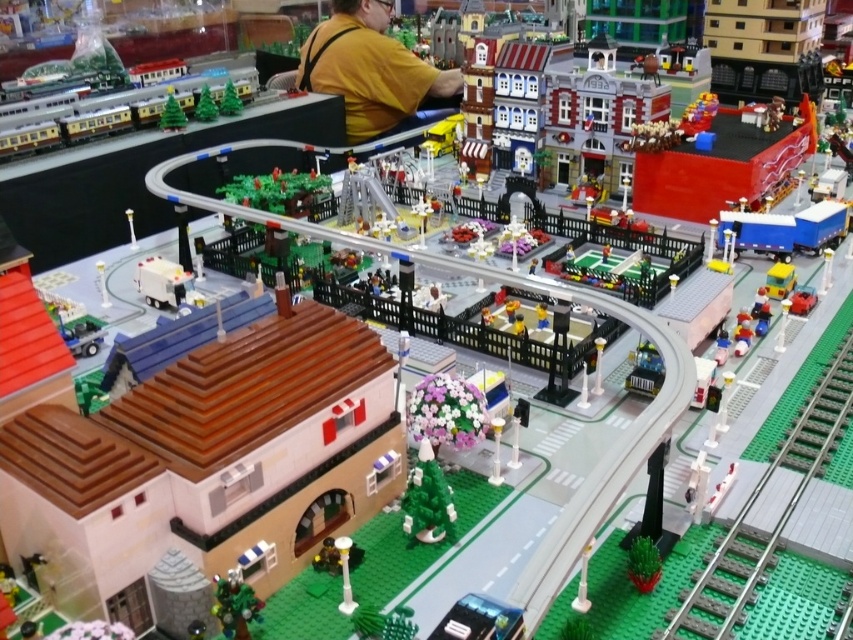
Question: Is white matte van at lower left positioned before green matte christmas tree at upper left?

Choices:
 (A) no
 (B) yes

Answer: (B)

Question: Can you confirm if yellow matte shirt at upper center is positioned to the left of pastel floral bouquet at center?

Choices:
 (A) yes
 (B) no

Answer: (A)

Question: Which of these objects is positioned farthest from the green matte tree at lower left?

Choices:
 (A) yellow matte shirt at upper center
 (B) white matte van at lower left
 (C) green matte christmas tree at center
 (D) green matte christmas tree at upper left

Answer: (A)

Question: Which of the following is the farthest from the observer?

Choices:
 (A) green matte tree at lower left
 (B) green matte christmas tree at center

Answer: (B)

Question: Which object is closer to the camera taking this photo?

Choices:
 (A) green matte tree at lower left
 (B) green plastic train track at lower right

Answer: (B)

Question: Can you confirm if green plastic train track at lower right is positioned above green matte christmas tree at center?

Choices:
 (A) yes
 (B) no

Answer: (A)